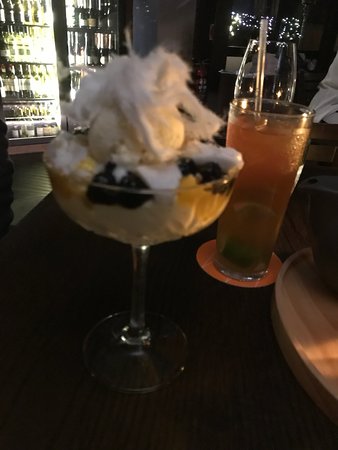
Locate an element on the screen. brown table is located at coordinates (44, 227), (153, 414).